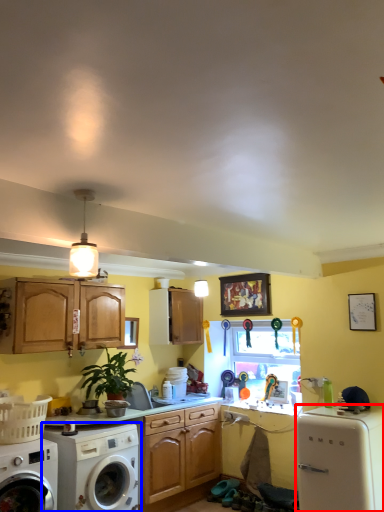
Question: Which object is closer to the camera taking this photo, dish washer (highlighted by a red box) or washing machine (highlighted by a blue box)?

Choices:
 (A) dish washer
 (B) washing machine

Answer: (A)